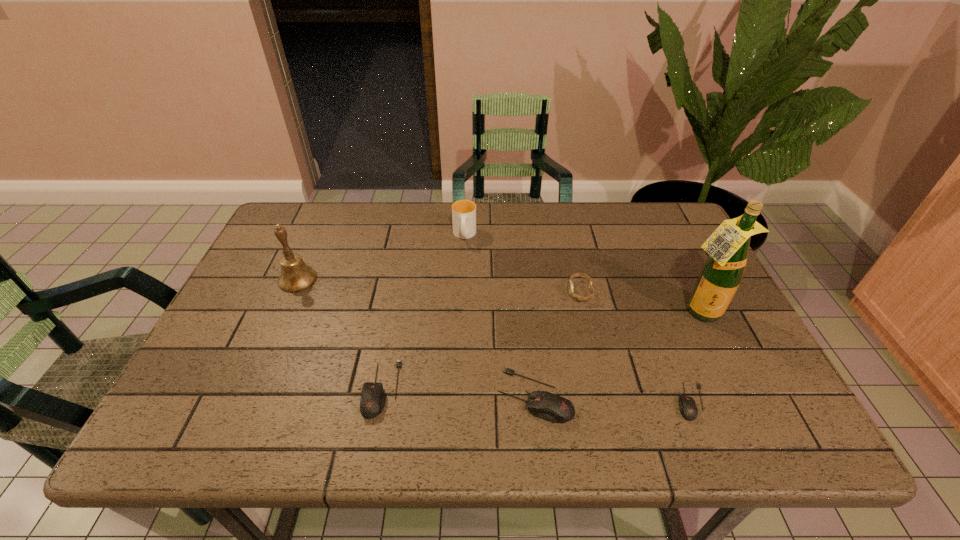
Please point a vacant point for placing a mouse on the left. Please provide its 2D coordinates. Your answer should be formatted as a tuple, i.e. [(x, y)], where the tuple contains the x and y coordinates of a point satisfying the conditions above.

[(231, 383)]